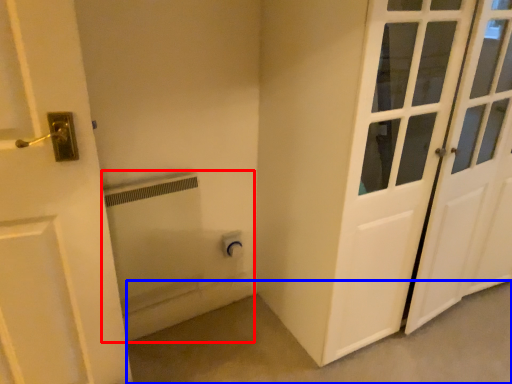
Question: Which point is closer to the camera, bath (highlighted by a red box) or concrete (highlighted by a blue box)?

Choices:
 (A) bath
 (B) concrete

Answer: (B)